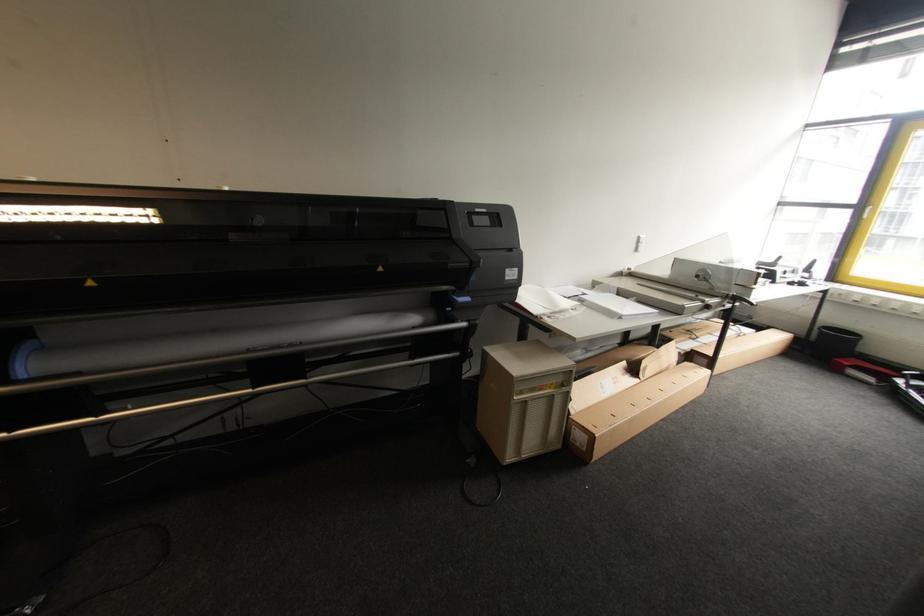
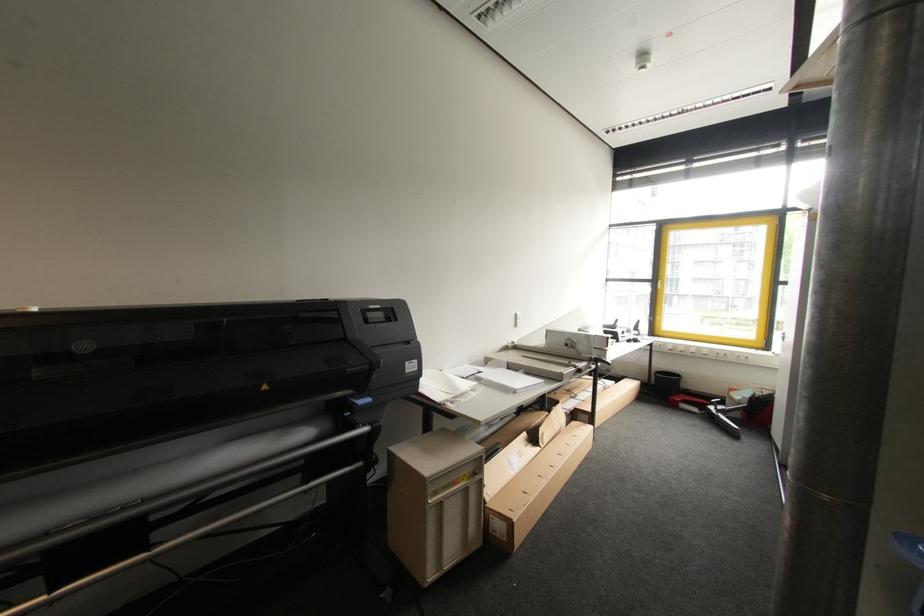
In the second image, find the point that corresponds to point (824, 333) in the first image.

(660, 378)